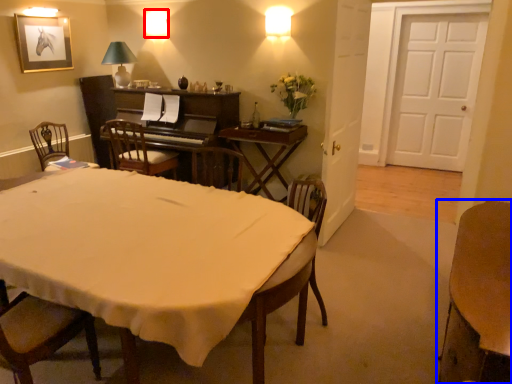
Question: Which object appears closest to the camera in this image, lamp (highlighted by a red box) or table (highlighted by a blue box)?

Choices:
 (A) lamp
 (B) table

Answer: (B)